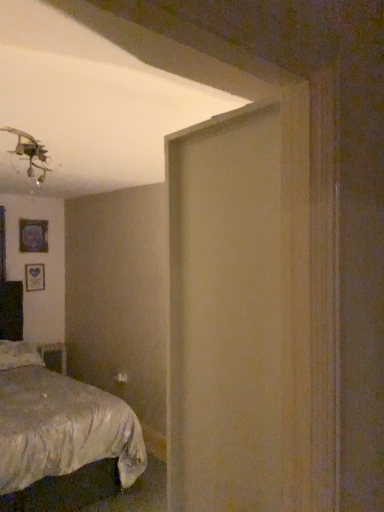
Question: Is point tap(66, 364) closer or farther from the camera than point tap(54, 402)?

Choices:
 (A) closer
 (B) farther

Answer: (B)

Question: Is wooden table at lower left situated inside silky white bed at lower left or outside?

Choices:
 (A) outside
 (B) inside

Answer: (A)

Question: Considering the real-world distances, which object is farthest from the white soft pillow at lower left?

Choices:
 (A) silky white bed at lower left
 (B) matte black picture frame at upper left, which is counted as the second picture frame, starting from the bottom
 (C) wooden table at lower left
 (D) wooden picture frame at left, which is the second picture frame in top-to-bottom order

Answer: (B)

Question: Estimate the real-world distances between objects in this image. Which object is farther from the silky white bed at lower left?

Choices:
 (A) white soft pillow at lower left
 (B) wooden table at lower left
 (C) wooden picture frame at left, which appears as the first picture frame when ordered from the bottom
 (D) matte black picture frame at upper left, which is counted as the second picture frame, starting from the bottom

Answer: (D)